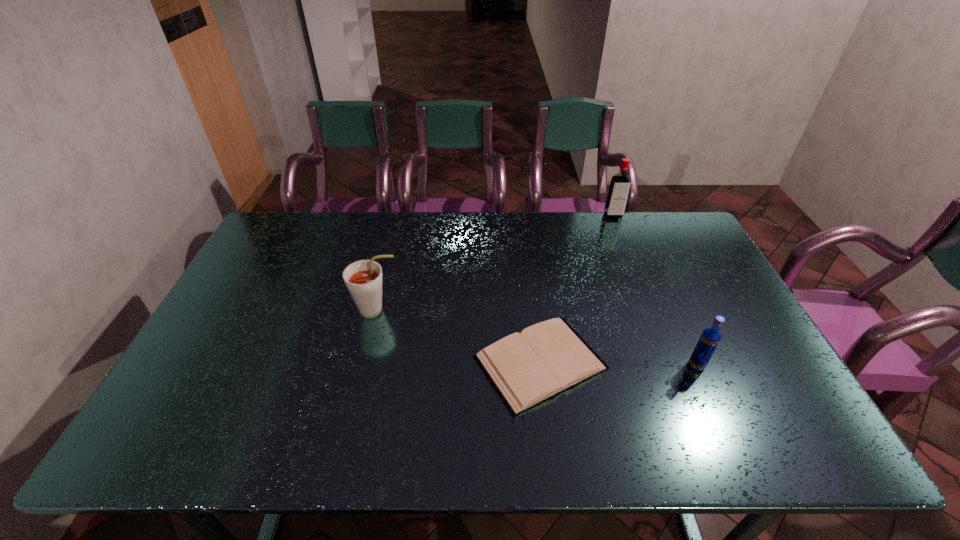
Where is `the left vodka`? This screenshot has height=540, width=960. the left vodka is located at coordinates (618, 192).

The width and height of the screenshot is (960, 540). I want to click on the taller vodka, so click(x=618, y=192).

Find the location of a particular element. root beer is located at coordinates (363, 278).

This screenshot has width=960, height=540. I want to click on the nearer vodka, so click(x=710, y=337).

Find the location of `the rightmost object`. the rightmost object is located at coordinates (710, 337).

Identify the location of the second object from left to right. (545, 359).

Locate an element on the screen. The height and width of the screenshot is (540, 960). hardback book is located at coordinates (545, 359).

Find the location of a particular element. This screenshot has height=540, width=960. free space located on the front and back of the third object from left to right is located at coordinates (638, 279).

At what (x,y) coordinates should I click in order to perform the action: click on free space located on the drink side of the root beer. Please return your answer as a coordinate pair (x, y). This screenshot has height=540, width=960. Looking at the image, I should click on (466, 310).

Find the location of a particular element. The image size is (960, 540). vacant position located on the left of the shorter vodka is located at coordinates (634, 365).